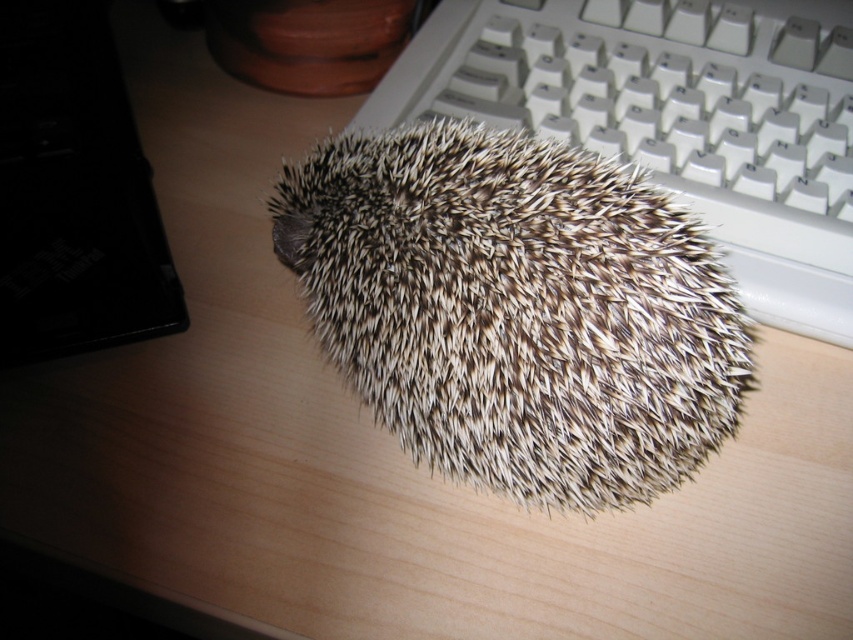
You are trying to place a small cup on the desk in the image. The cup has a diameter of 8 cm. The point where you want to place it is at coordinates point (x=517, y=308). Is there enough space there to place the cup without overlapping the brown spiny hedgehog at center?

The point (x=517, y=308) is where the brown spiny hedgehog at center is located. Therefore, placing the cup there would overlap with the hedgehog, so it is not possible to place the cup there without overlapping.

You are organizing items on your desk and need to place a new item between the brown spiny hedgehog at center and the white plastic keyboard at upper right. Based on their sizes, which item should be placed closer to the smaller object?

The brown spiny hedgehog at center is smaller than the white plastic keyboard at upper right, so the new item should be placed closer to the brown spiny hedgehog at center.